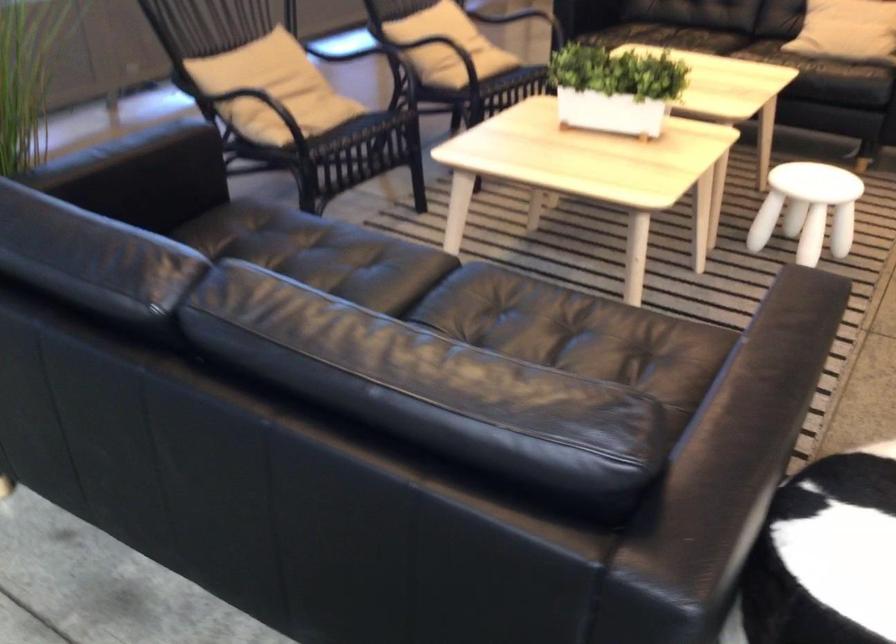
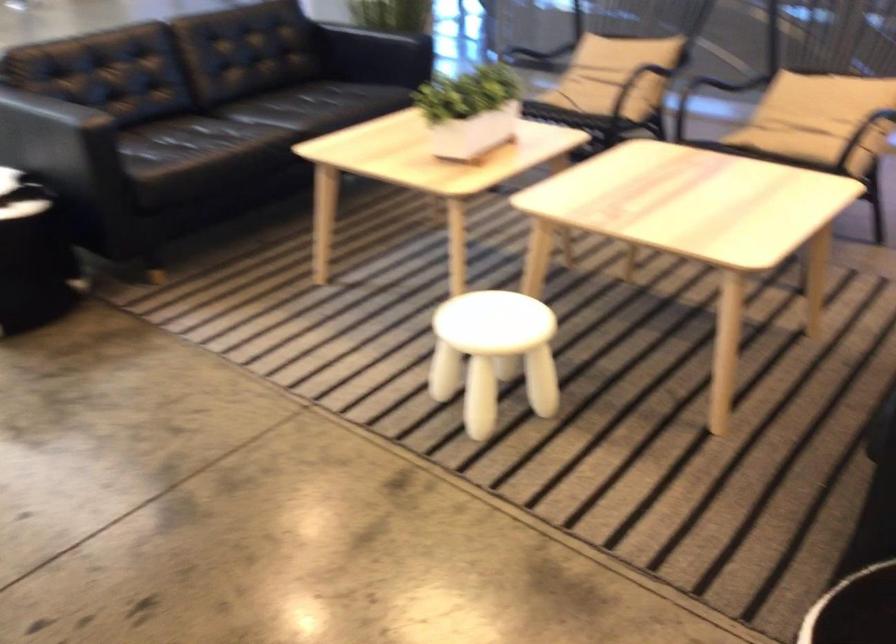
In the second image, find the point that corresponds to point (316, 111) in the first image.

(597, 91)